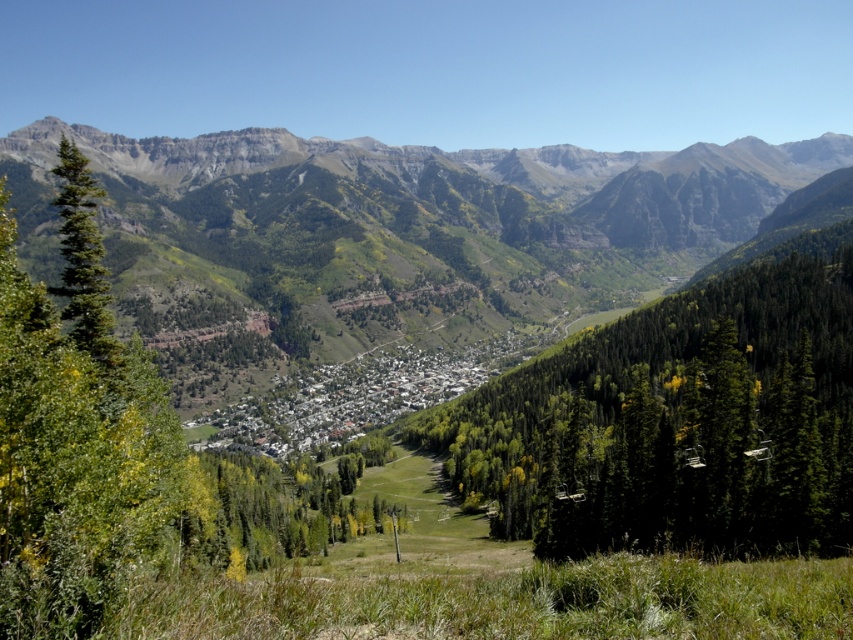
Question: Which object is closer to the camera taking this photo?

Choices:
 (A) green leafy tree at left
 (B) green forested mountain range at center
 (C) green textured tree at center

Answer: (A)

Question: Does green forested mountain range at center appear over green textured tree at center?

Choices:
 (A) yes
 (B) no

Answer: (A)

Question: Does green forested mountain range at center have a greater width compared to green leafy tree at left?

Choices:
 (A) no
 (B) yes

Answer: (B)

Question: Does green forested mountain range at center appear over green textured tree at center?

Choices:
 (A) yes
 (B) no

Answer: (A)

Question: Which of the following is the closest to the observer?

Choices:
 (A) (122, 330)
 (B) (831, 552)

Answer: (B)

Question: Estimate the real-world distances between objects in this image. Which object is farther from the green leafy tree at left?

Choices:
 (A) green forested mountain range at center
 (B) green textured tree at center

Answer: (A)